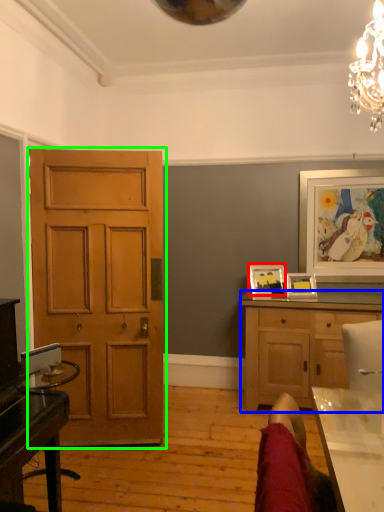
Question: Which object is positioned closest to picture frame (highlighted by a red box)? Select from cabinetry (highlighted by a blue box) and door (highlighted by a green box).

Choices:
 (A) cabinetry
 (B) door

Answer: (A)